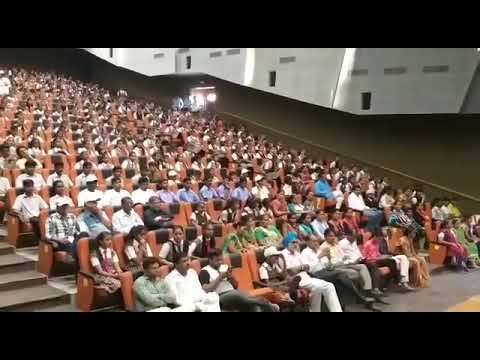
I want to click on black rectangle below photograph, so click(252, 330).